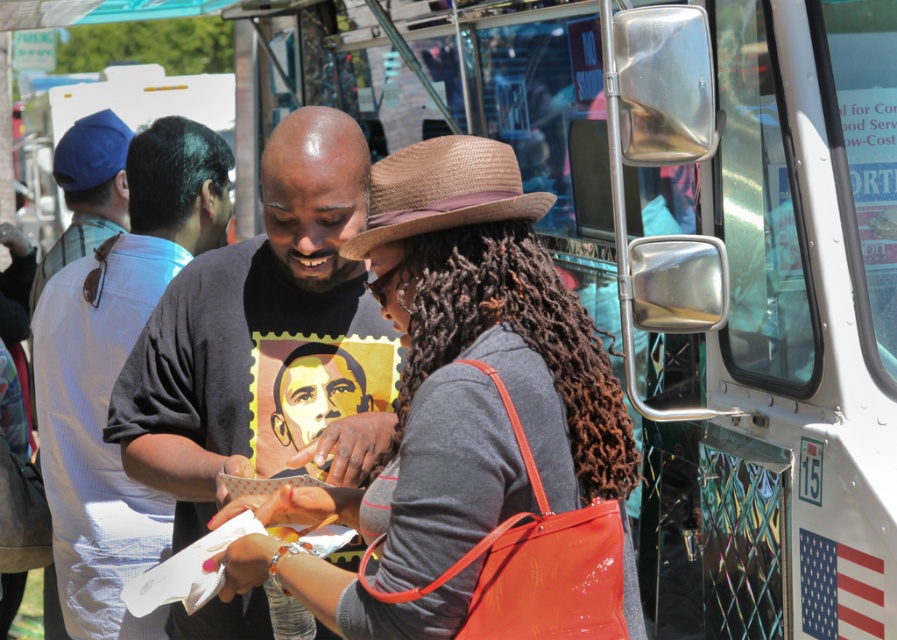
Question: Among these objects, which one is farthest from the camera?

Choices:
 (A) white striped shirt at left
 (B) brown curly hair at center

Answer: (A)

Question: Among these points, which one is farthest from the camera?

Choices:
 (A) (533, 557)
 (B) (460, 486)
 (C) (106, 125)

Answer: (C)

Question: Is white striped shirt at left positioned in front of blue fabric cap at left?

Choices:
 (A) yes
 (B) no

Answer: (A)

Question: Can you confirm if matte black t-shirt at center is positioned to the left of orange glossy handbag at center?

Choices:
 (A) no
 (B) yes

Answer: (B)

Question: Which point appears farthest from the camera in this image?

Choices:
 (A) (212, 605)
 (B) (53, 378)

Answer: (B)

Question: Can you confirm if orange glossy handbag at center is positioned to the left of blue fabric cap at left?

Choices:
 (A) yes
 (B) no

Answer: (B)